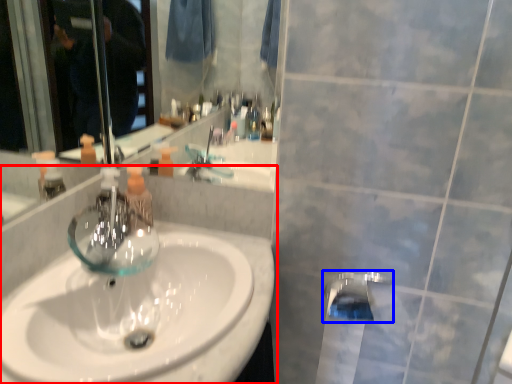
Question: Which object is closer to the camera taking this photo, sink (highlighted by a red box) or tap (highlighted by a blue box)?

Choices:
 (A) sink
 (B) tap

Answer: (A)